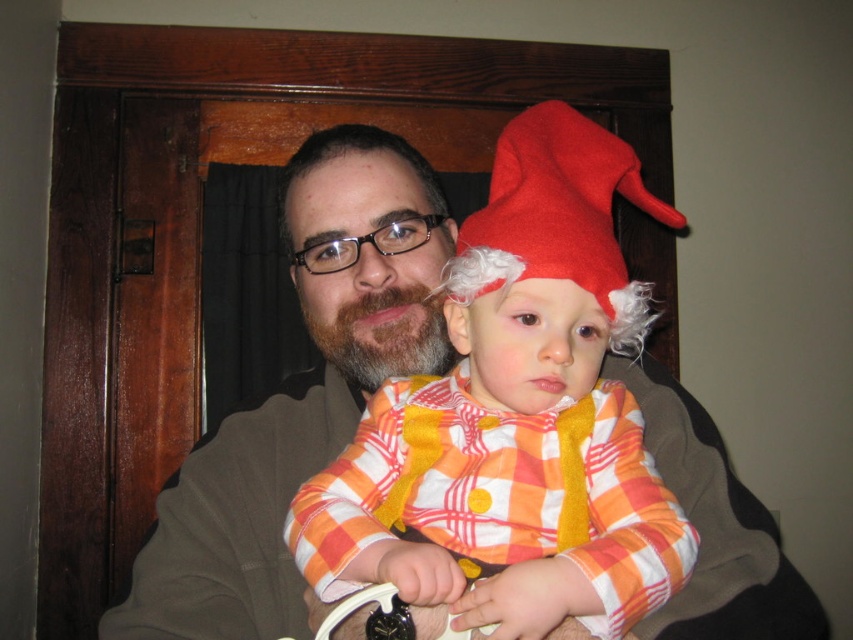
Between point (390, 205) and point (497, 204), which one is positioned behind?

Point (390, 205)

I want to click on matte brown jacket at center, so click(x=299, y=394).

Where is `matte brown jacket at center`? The width and height of the screenshot is (853, 640). matte brown jacket at center is located at coordinates (299, 394).